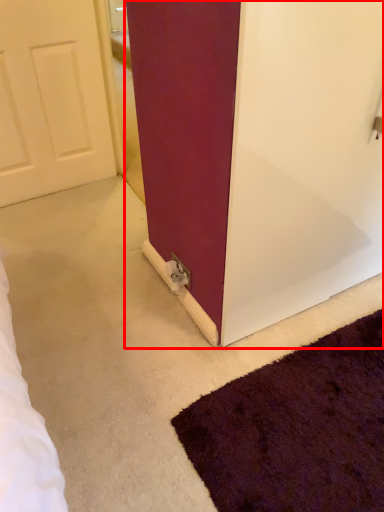
Question: From the image's perspective, where is door (annotated by the red box) located relative to electric outlet?

Choices:
 (A) below
 (B) above

Answer: (B)